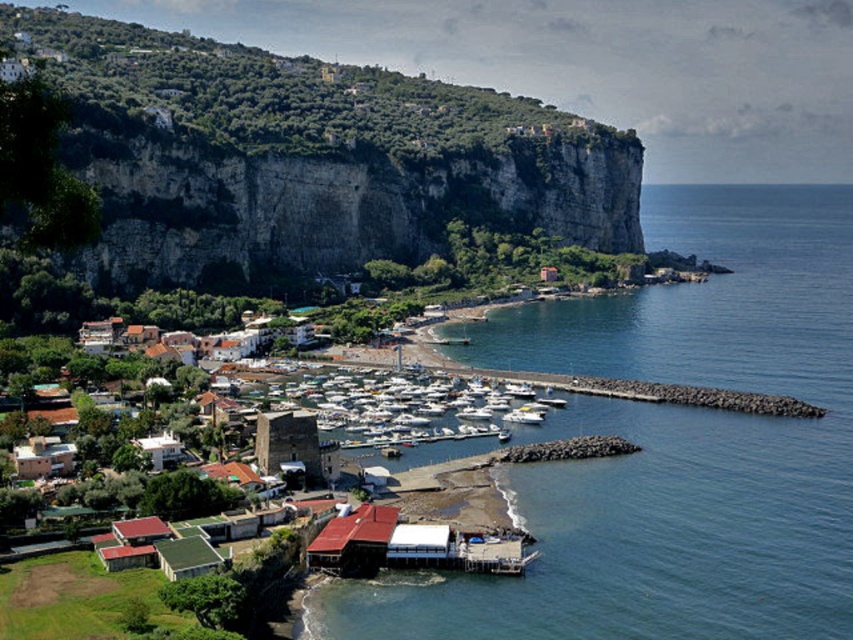
You are standing at the edge of the harbor looking out towards the sea. You see the blue water at lower center and the rugged stone cliff at upper left. Which object is closer to your current position?

The blue water at lower center is closer to your current position because it is located below the rugged stone cliff at upper left.

You are a photographer positioned at the edge of the harbor, aiming to capture the blue water at lower center and the red corrugated metal hut at lower center in your shot. Based on their relative positions, which object will appear larger in your photograph?

The blue water at lower center appears larger in the photograph because it is taller than the red corrugated metal hut at lower center.